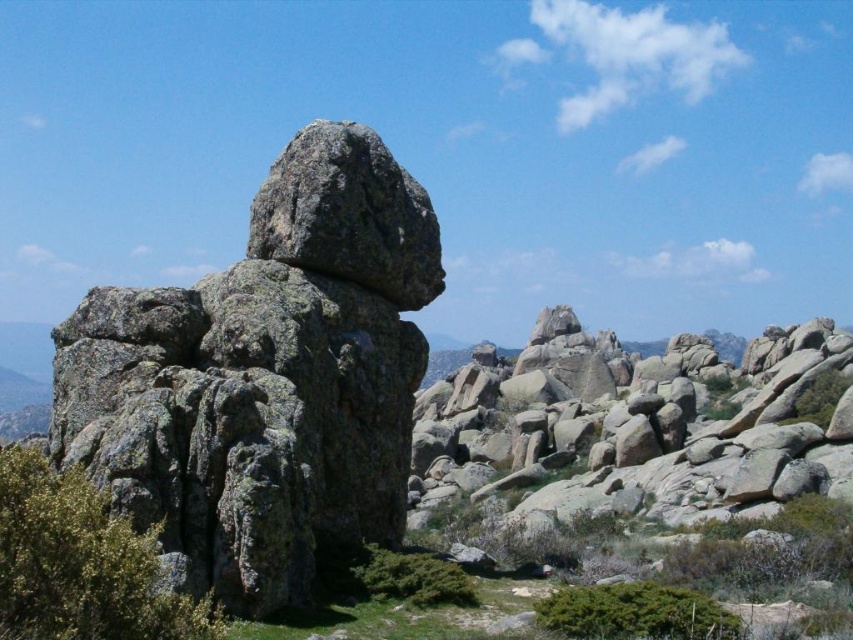
Question: Which point is farther to the camera?

Choices:
 (A) 263,237
 (B) 160,406

Answer: (A)

Question: Can you confirm if gray rough rock at center is bigger than granite rock at center?

Choices:
 (A) yes
 (B) no

Answer: (A)

Question: Does rough granite rock at center appear under gray rough rock at center?

Choices:
 (A) no
 (B) yes

Answer: (A)

Question: Where is gray rough rock at center located in relation to granite rock at center in the image?

Choices:
 (A) right
 (B) left

Answer: (A)

Question: Which point is closer to the camera?

Choices:
 (A) (329, 236)
 (B) (664, 465)
 (C) (376, 477)

Answer: (A)

Question: Which of the following is the closest to the observer?

Choices:
 (A) tap(379, 140)
 (B) tap(309, 317)

Answer: (B)